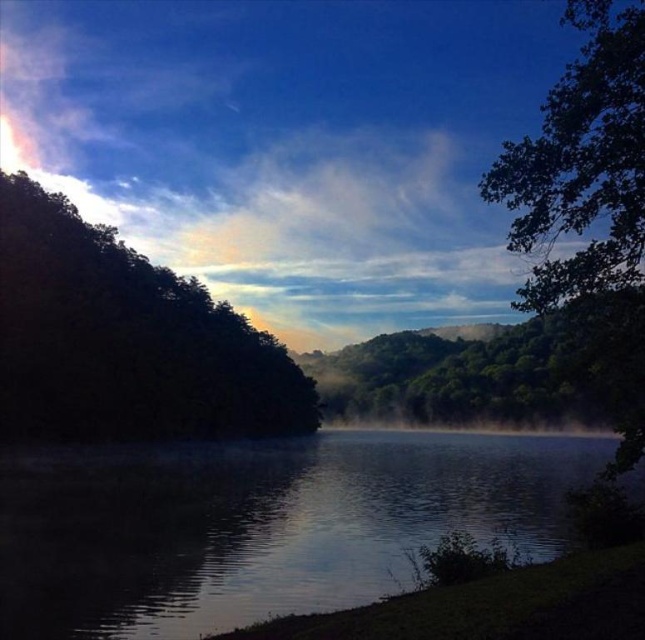
You are standing at the lakeside and want to walk towards both the dark green leafy tree at left and the green leafy tree at upper right. Which tree will you reach first?

You will reach the dark green leafy tree at left first because it is closer to you than the green leafy tree at upper right, which is further away.

You are standing at the lakeside and want to take a photo of both the dark green leafy tree at left and the green leafy tree at center. Which tree should you position closer to the front of the photo to ensure both are fully visible?

To ensure both the dark green leafy tree at left and the green leafy tree at center are fully visible in the photo, you should position the green leafy tree at center closer to the front. Since the dark green leafy tree at left is taller, placing the shorter tree in front will prevent it from being obscured by the taller one.